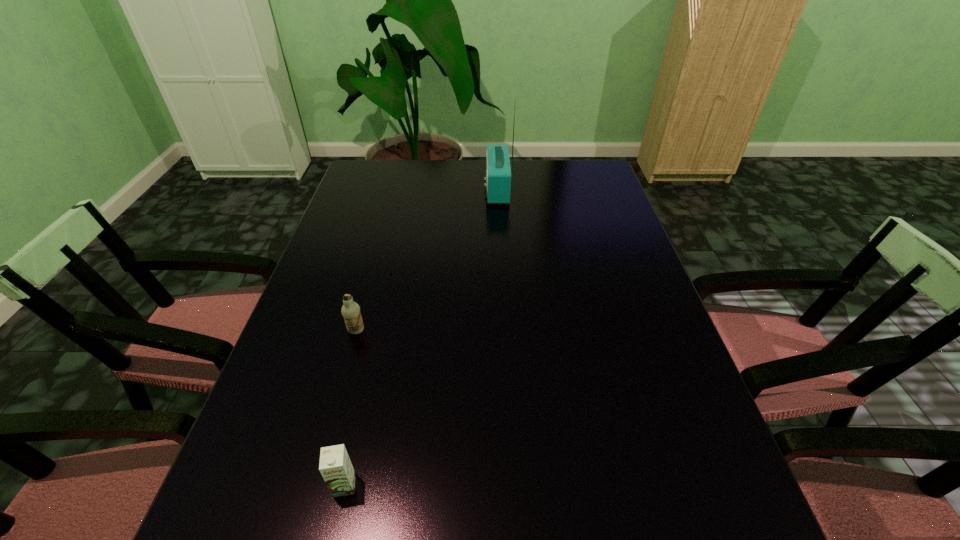
Where is `free space between the second nearest object and the nearer chocolate milk`? Image resolution: width=960 pixels, height=540 pixels. free space between the second nearest object and the nearer chocolate milk is located at coordinates (350, 408).

The image size is (960, 540). I want to click on free space that is in between the nearer chocolate milk and the leftmost object, so click(x=350, y=408).

The width and height of the screenshot is (960, 540). I want to click on free space between the nearer chocolate milk and the radio receiver, so click(x=420, y=337).

Locate an element on the screen. free space between the nearer chocolate milk and the farthest object is located at coordinates (420, 337).

Where is `blank region between the farther chocolate milk and the radio receiver`? The height and width of the screenshot is (540, 960). blank region between the farther chocolate milk and the radio receiver is located at coordinates (427, 260).

Where is `vacant area between the farther chocolate milk and the tallest object`? This screenshot has height=540, width=960. vacant area between the farther chocolate milk and the tallest object is located at coordinates (427, 260).

I want to click on free spot between the farthest object and the farther chocolate milk, so click(x=427, y=260).

In order to click on object that stands as the closest to the nearer chocolate milk in this screenshot , I will do [350, 310].

At what (x,y) coordinates should I click in order to perform the action: click on object that stands as the second closest to the tallest object. Please return your answer as a coordinate pair (x, y). The height and width of the screenshot is (540, 960). Looking at the image, I should click on (335, 466).

At what (x,y) coordinates should I click in order to perform the action: click on free region that satisfies the following two spatial constraints: 1. on the front side of the nearer chocolate milk; 2. on the left side of the leftmost object. Please return your answer as a coordinate pair (x, y). This screenshot has height=540, width=960. Looking at the image, I should click on (314, 485).